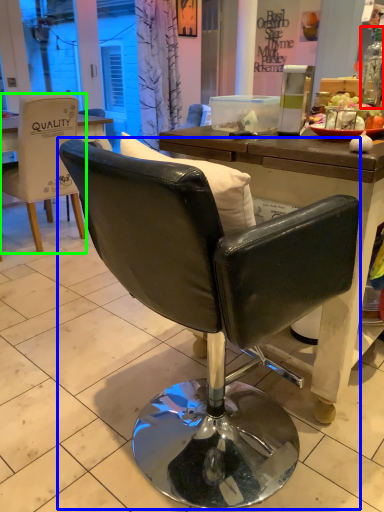
Question: Which object is the farthest from bottle (highlighted by a red box)? Choose among these: chair (highlighted by a blue box) or chair (highlighted by a green box).

Choices:
 (A) chair
 (B) chair

Answer: (B)